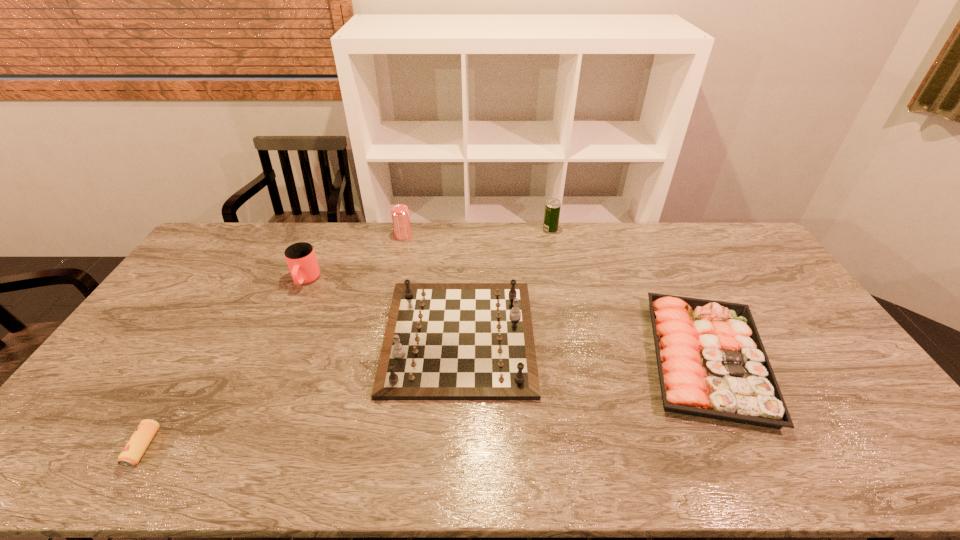
This screenshot has width=960, height=540. In order to click on blank space located 0.400m on the handle side of the cup in this screenshot , I will do `click(252, 399)`.

What are the coordinates of `free region located on the board of the fourth tallest object` in the screenshot? It's located at (600, 337).

The width and height of the screenshot is (960, 540). What are the coordinates of `vacant space situated on the left of the fifth tallest object` in the screenshot? It's located at (588, 359).

This screenshot has height=540, width=960. In order to click on vacant region located on the right of the nearest beer can in this screenshot , I will do `click(178, 447)`.

At what (x,y) coordinates should I click in order to perform the action: click on object that is at the near edge. Please return your answer as a coordinate pair (x, y). Image resolution: width=960 pixels, height=540 pixels. Looking at the image, I should click on (131, 454).

I want to click on free spot at the far edge of the desktop, so click(413, 256).

Where is `vacant region at the near edge of the desktop`? The height and width of the screenshot is (540, 960). vacant region at the near edge of the desktop is located at coordinates (406, 451).

This screenshot has width=960, height=540. Identify the location of vacant space at the left edge of the desktop. (208, 264).

The width and height of the screenshot is (960, 540). In the image, there is a desktop. Identify the location of vacant space at the right edge. (774, 342).

The image size is (960, 540). In the image, there is a desktop. Find the location of `vacant space at the far left corner`. vacant space at the far left corner is located at coordinates (240, 237).